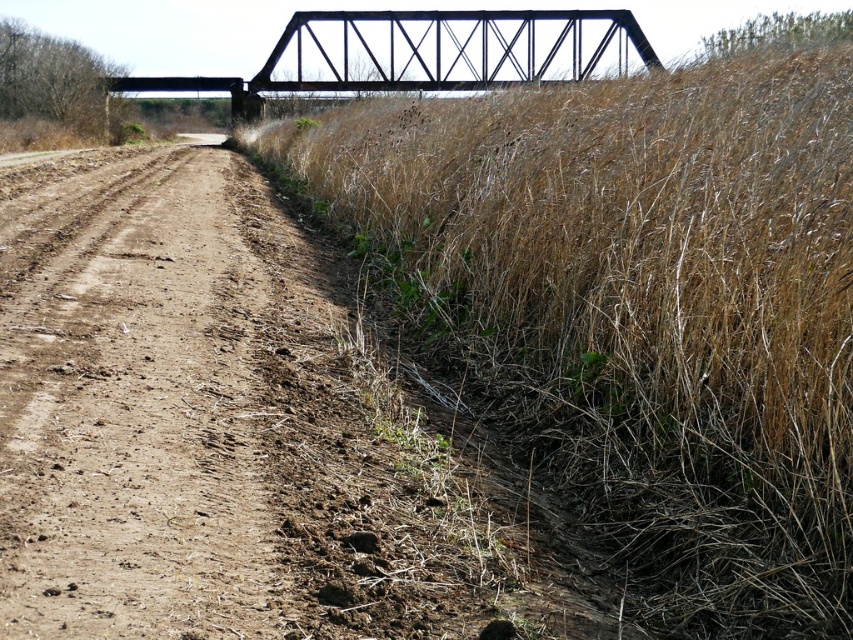
Question: Which is nearer to the dry grass at upper right?

Choices:
 (A) brown dirt track at left
 (B) black metal bridge at upper center

Answer: (B)

Question: Can you confirm if dry grass at upper right is positioned to the left of black metal bridge at upper center?

Choices:
 (A) no
 (B) yes

Answer: (A)

Question: Does dry grass at upper right have a greater width compared to brown dirt track at left?

Choices:
 (A) no
 (B) yes

Answer: (B)

Question: Which object is farther from the camera taking this photo?

Choices:
 (A) brown dirt track at left
 (B) black metal bridge at upper center
 (C) dry grass at upper right

Answer: (B)

Question: Where is dry grass at upper right located in relation to black metal bridge at upper center in the image?

Choices:
 (A) left
 (B) right

Answer: (B)

Question: Which point appears farthest from the camera in this image?

Choices:
 (A) (329, 12)
 (B) (309, 180)
 (C) (184, 269)

Answer: (A)